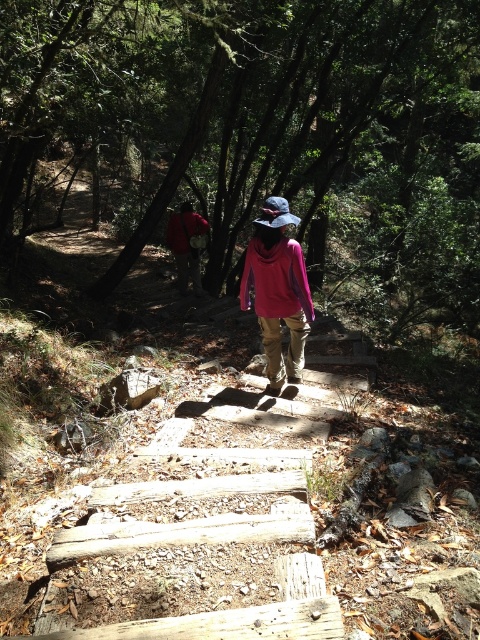
You are a hiker navigating a forest trail and see the pink matte jacket at center and the red fabric backpack at center. Which object is positioned lower in the scene?

The pink matte jacket at center is located below the red fabric backpack at center, so it is positioned lower in the scene.

You are a hiker who wants to locate the pink matte jacket at center in the image. According to the coordinates provided, where would you look?

You should look at point (277, 291) to find the pink matte jacket at center.

You are a hiker on a forest trail and see the pink matte jacket at center and the red fabric backpack at center. Which one is closer to you?

The pink matte jacket at center is closer to you because it is in front of the red fabric backpack at center.